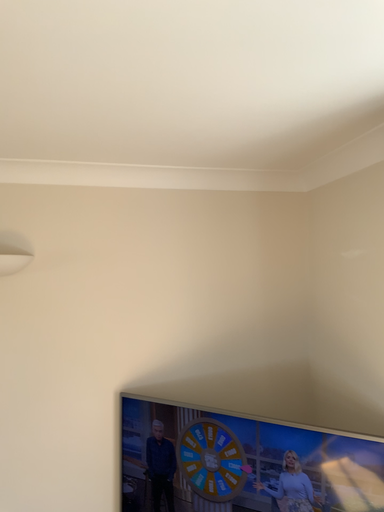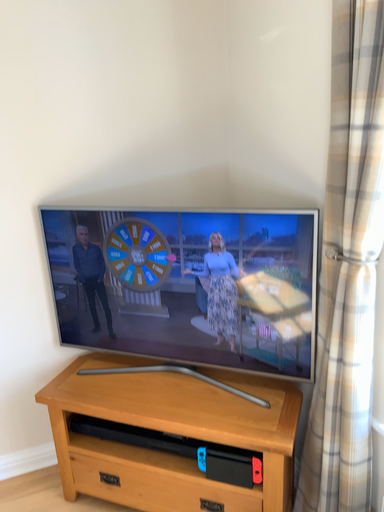
Question: How did the camera likely rotate when shooting the video?

Choices:
 (A) rotated left
 (B) rotated right

Answer: (B)